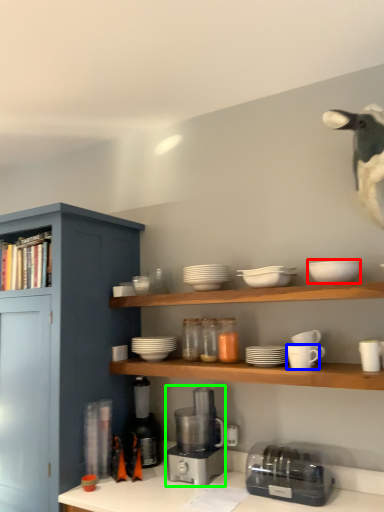
Question: Estimate the real-world distances between objects in this image. Which object is farther from tableware (highlighted by a red box), tableware (highlighted by a blue box) or coffee machine (highlighted by a green box)?

Choices:
 (A) tableware
 (B) coffee machine

Answer: (B)